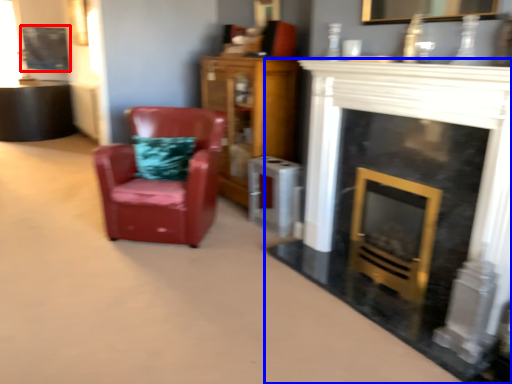
Question: Which object appears closest to the camera in this image, picture frame (highlighted by a red box) or fireplace (highlighted by a blue box)?

Choices:
 (A) picture frame
 (B) fireplace

Answer: (B)